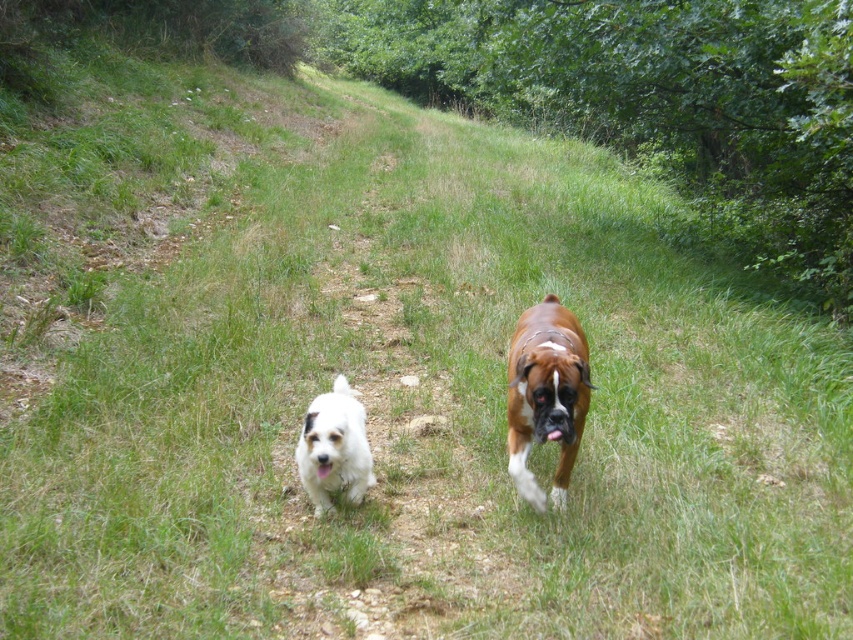
Question: Which point appears farthest from the camera in this image?

Choices:
 (A) (325, 394)
 (B) (560, 468)

Answer: (A)

Question: Observing the image, what is the correct spatial positioning of brown glossy dog at center in reference to white fluffy dog at center?

Choices:
 (A) below
 (B) above

Answer: (B)

Question: Can you confirm if brown glossy dog at center is positioned below white fluffy dog at center?

Choices:
 (A) yes
 (B) no

Answer: (B)

Question: Does brown glossy dog at center appear on the left side of white fluffy dog at center?

Choices:
 (A) yes
 (B) no

Answer: (B)

Question: Which point is farther to the camera?

Choices:
 (A) white fluffy dog at center
 (B) brown glossy dog at center

Answer: (A)